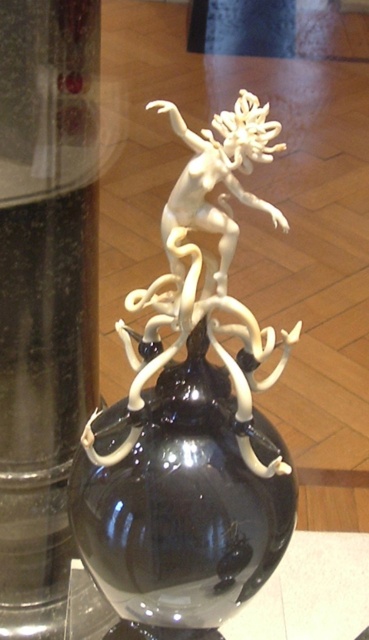
Question: Does black glass vase at center have a lesser width compared to transparent glass table at lower center?

Choices:
 (A) no
 (B) yes

Answer: (B)

Question: Is black glass vase at center to the left of transparent glass table at lower center from the viewer's perspective?

Choices:
 (A) yes
 (B) no

Answer: (A)

Question: Can you confirm if black glass vase at center is bigger than transparent glass table at lower center?

Choices:
 (A) no
 (B) yes

Answer: (A)